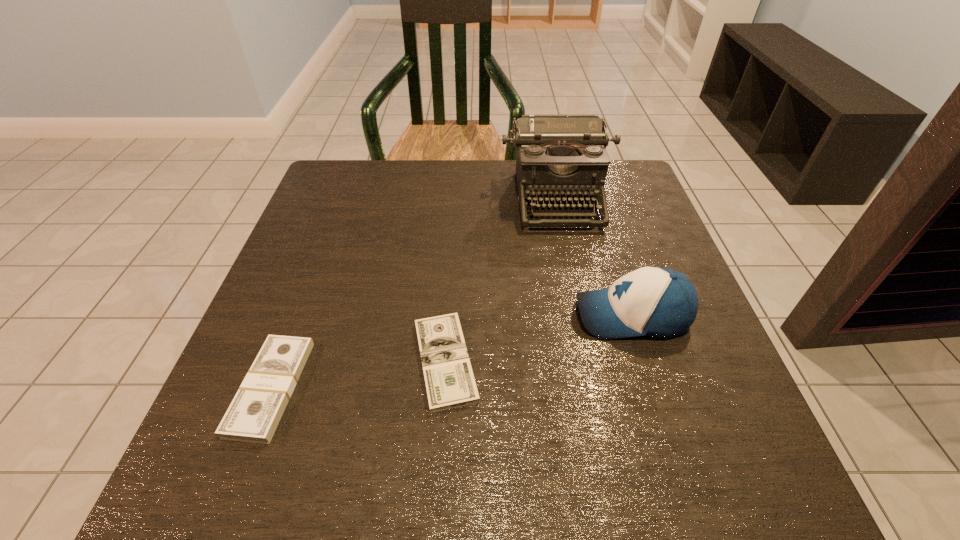
In order to click on vacant space at the far edge of the desktop in this screenshot , I will do `click(415, 206)`.

You are a GUI agent. You are given a task and a screenshot of the screen. Output one action in this format:
    pyautogui.click(x=<x>, y=<y>)
    Task: Click on the free region at the near edge of the desktop
    The height and width of the screenshot is (540, 960).
    Given the screenshot: What is the action you would take?
    pyautogui.click(x=304, y=487)

Locate an element on the screen. free space at the left edge of the desktop is located at coordinates (321, 237).

You are a GUI agent. You are given a task and a screenshot of the screen. Output one action in this format:
    pyautogui.click(x=<x>, y=<y>)
    Task: Click on the vacant space at the right edge of the desktop
    
    Given the screenshot: What is the action you would take?
    pyautogui.click(x=728, y=387)

The image size is (960, 540). In the image, there is a desktop. What are the coordinates of `vacant space at the far left corner` in the screenshot? It's located at (340, 166).

Identify the location of vacant space at the far right corner of the desktop. (586, 199).

The height and width of the screenshot is (540, 960). Identify the location of vacant region between the farthest object and the baseball cap. (594, 256).

Locate an element on the screen. The width and height of the screenshot is (960, 540). unoccupied position between the leftmost object and the farthest object is located at coordinates (414, 293).

This screenshot has height=540, width=960. In order to click on free point between the shorter dollar and the typewriter in this screenshot , I will do `click(501, 279)`.

Where is `vacant space that is in between the typewriter and the leftmost object`? vacant space that is in between the typewriter and the leftmost object is located at coordinates (414, 293).